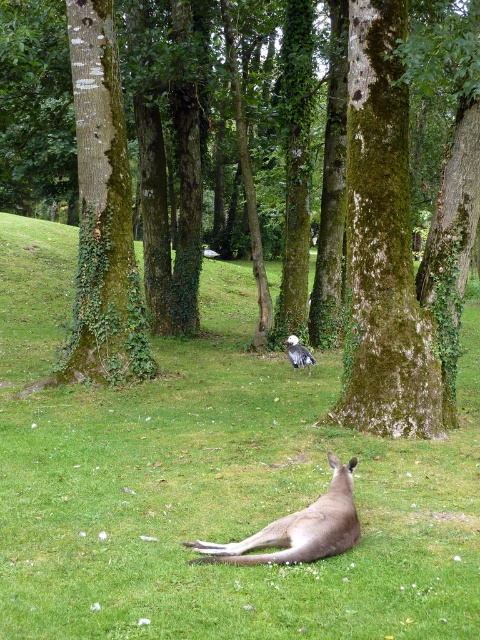
Question: Can you confirm if green grassy at center is positioned above green mossy tree at center?

Choices:
 (A) no
 (B) yes

Answer: (A)

Question: Is green mossy tree at center thinner than gray fur kangaroo at lower center?

Choices:
 (A) yes
 (B) no

Answer: (B)

Question: Does green grassy at center appear over green mossy tree at center?

Choices:
 (A) no
 (B) yes

Answer: (A)

Question: Among these points, which one is farthest from the camera?

Choices:
 (A) pyautogui.click(x=348, y=500)
 (B) pyautogui.click(x=101, y=317)
 (C) pyautogui.click(x=181, y=554)
 (D) pyautogui.click(x=302, y=348)

Answer: (D)

Question: Which of the following is the farthest from the observer?

Choices:
 (A) green grassy at center
 (B) white feathered bird at center

Answer: (B)

Question: Which point is farther to the camera?

Choices:
 (A) (368, 260)
 (B) (343, 465)
 (C) (321, 595)

Answer: (A)